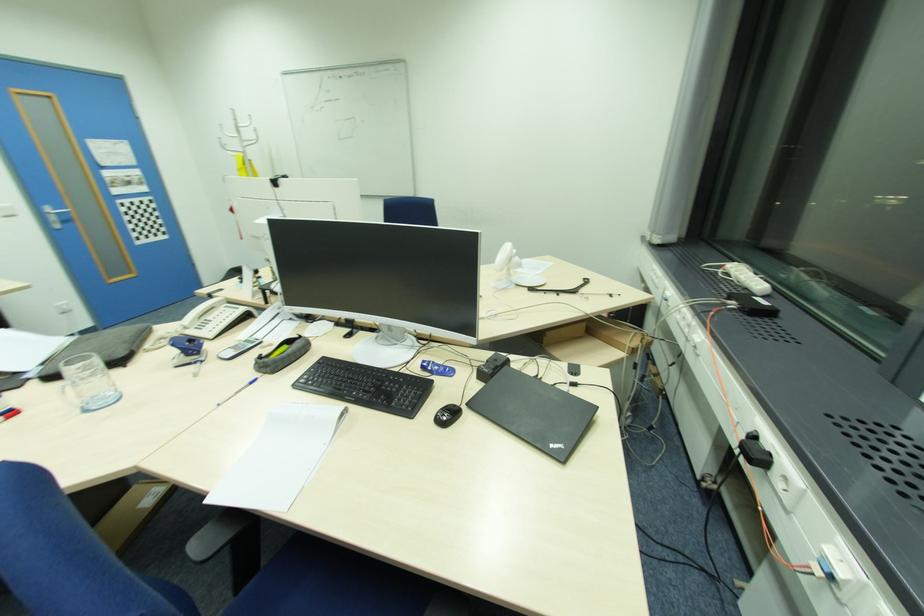
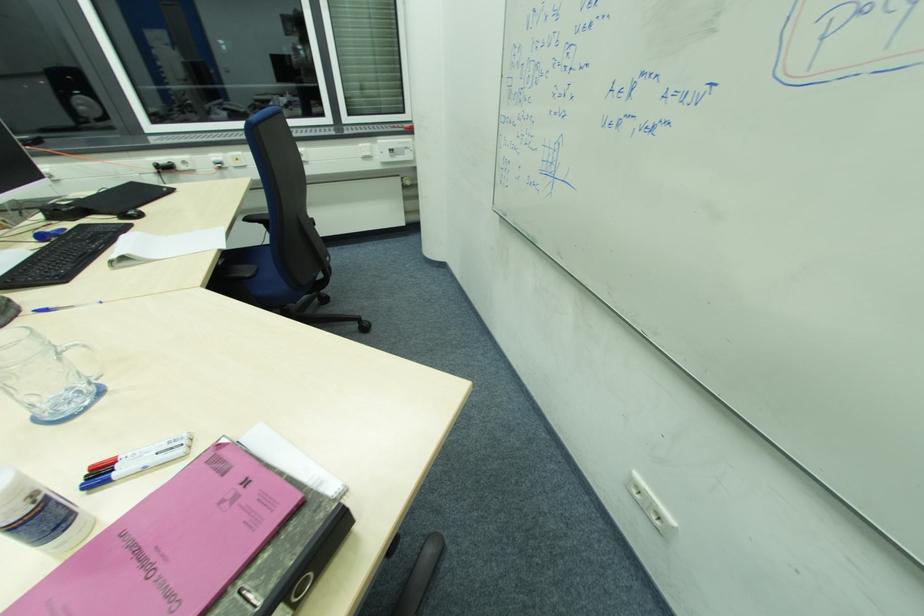
Where in the second image is the point corresponding to pixel 447 418 from the first image?

(140, 211)